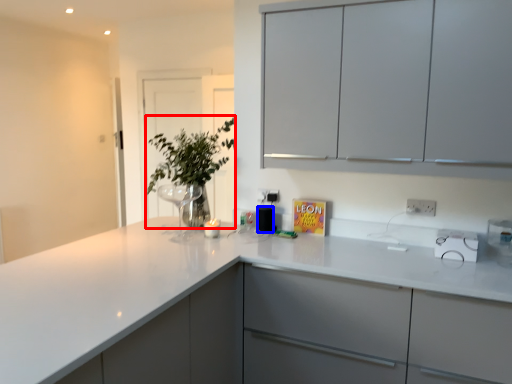
Question: Among these objects, which one is nearest to the camera, plant (highlighted by a red box) or appliance (highlighted by a blue box)?

Choices:
 (A) plant
 (B) appliance

Answer: (A)